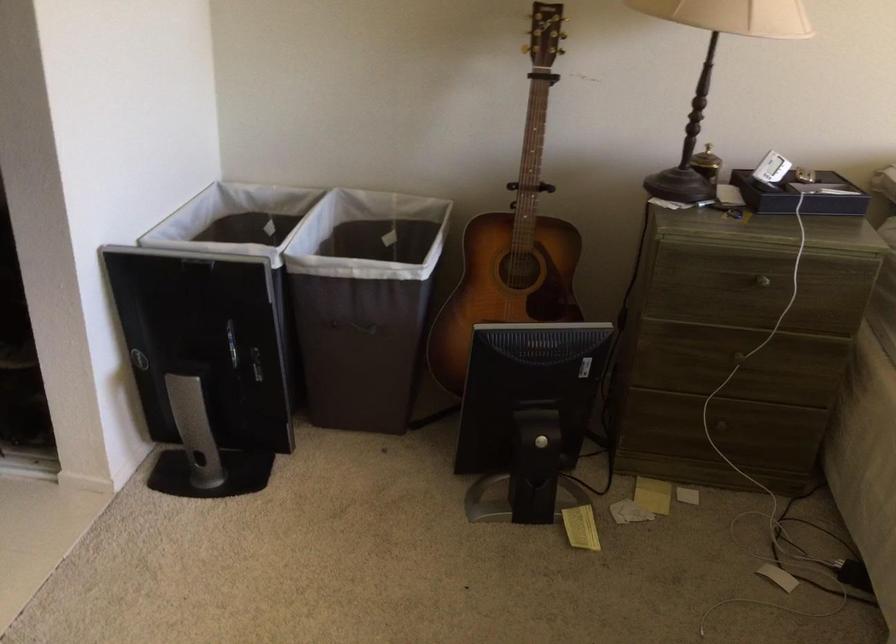
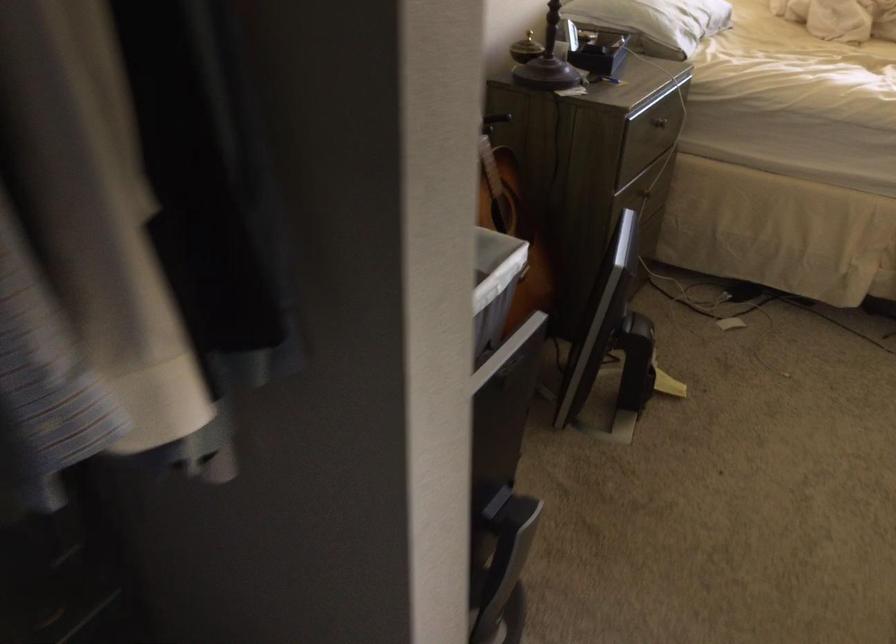
Locate, in the second image, the point that corresponds to (366,266) in the first image.

(494, 286)